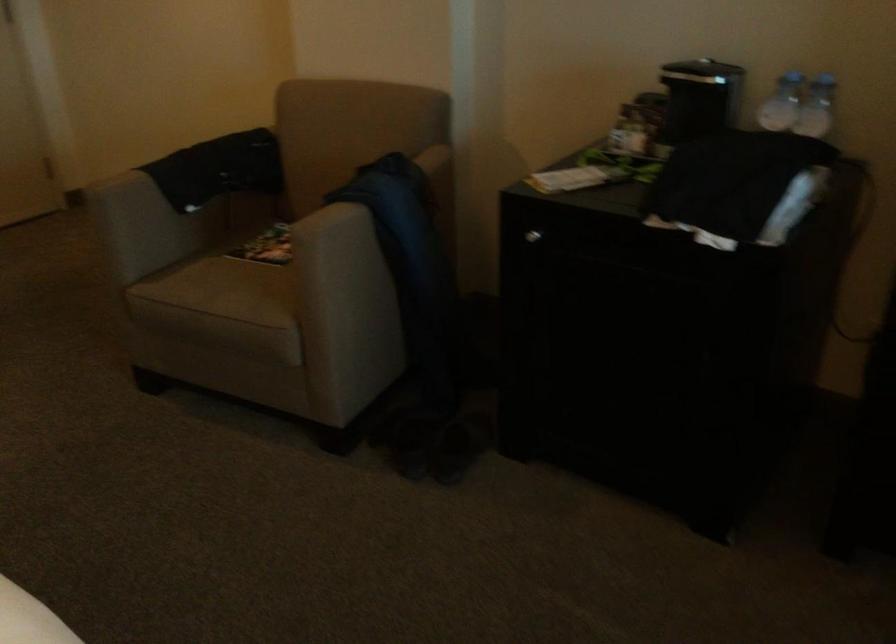
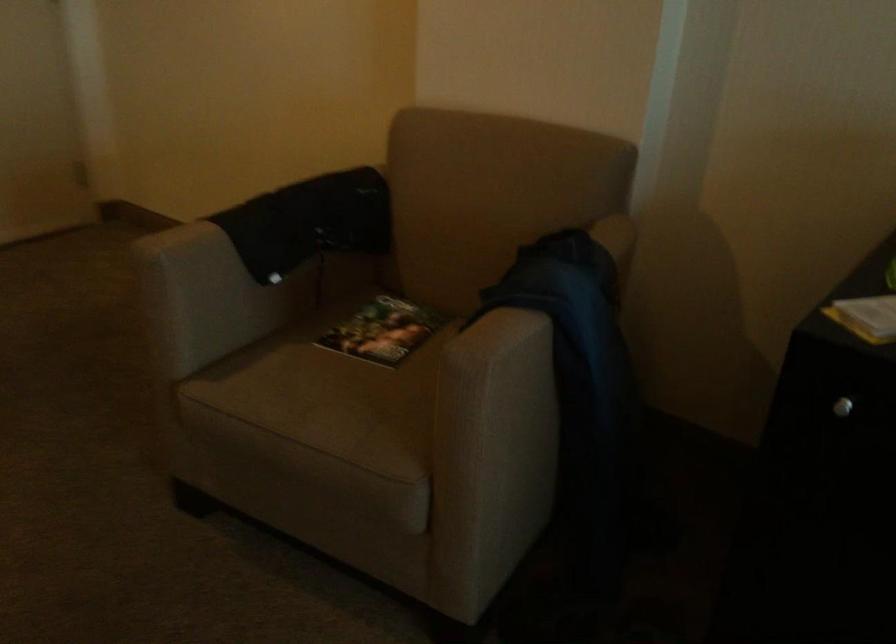
Where in the second image is the point corresponding to the point at 230,289 from the first image?

(330, 404)